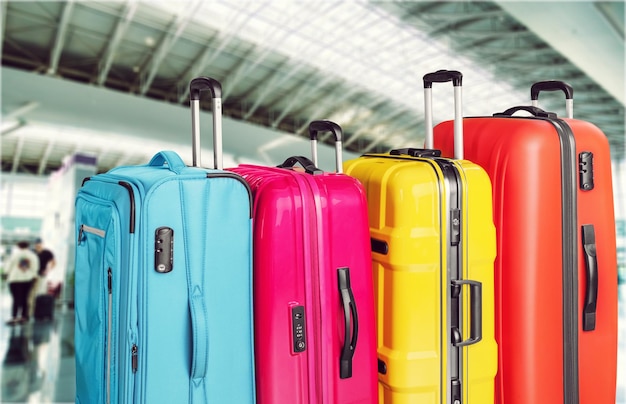
At what (x,y) coordinates should I click in order to perform the action: click on roller handles. Please return your answer as a coordinate pair (x, y). The height and width of the screenshot is (404, 626). Looking at the image, I should click on coord(200,145), coord(342,144), coord(456,105), coord(548,86).